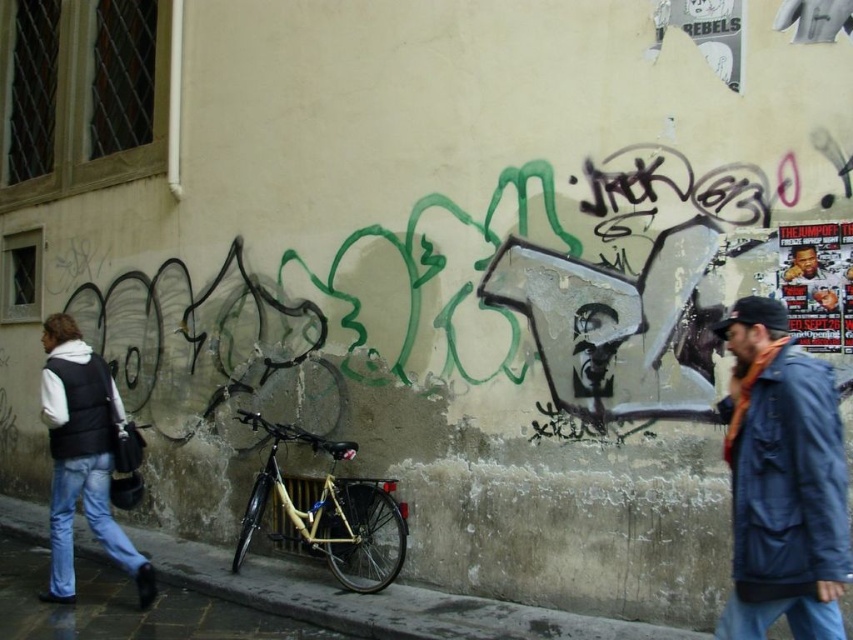
Question: Can you confirm if blue fabric jacket at lower right is wider than concrete sidewalk at center?

Choices:
 (A) no
 (B) yes

Answer: (A)

Question: Which point is farther from the camera taking this photo?

Choices:
 (A) (314, 513)
 (B) (285, 573)
 (C) (741, 609)

Answer: (B)

Question: Which object appears closest to the camera in this image?

Choices:
 (A) black matte vest at left
 (B) blue fabric jacket at lower right
 (C) concrete sidewalk at center
 (D) gold metallic bicycle at center

Answer: (B)

Question: Does blue fabric jacket at lower right have a lesser width compared to concrete sidewalk at center?

Choices:
 (A) no
 (B) yes

Answer: (B)

Question: In this image, where is blue fabric jacket at lower right located relative to concrete sidewalk at center?

Choices:
 (A) below
 (B) above

Answer: (B)

Question: Estimate the real-world distances between objects in this image. Which object is farther from the concrete sidewalk at center?

Choices:
 (A) blue fabric jacket at lower right
 (B) gold metallic bicycle at center
 (C) black matte vest at left

Answer: (A)